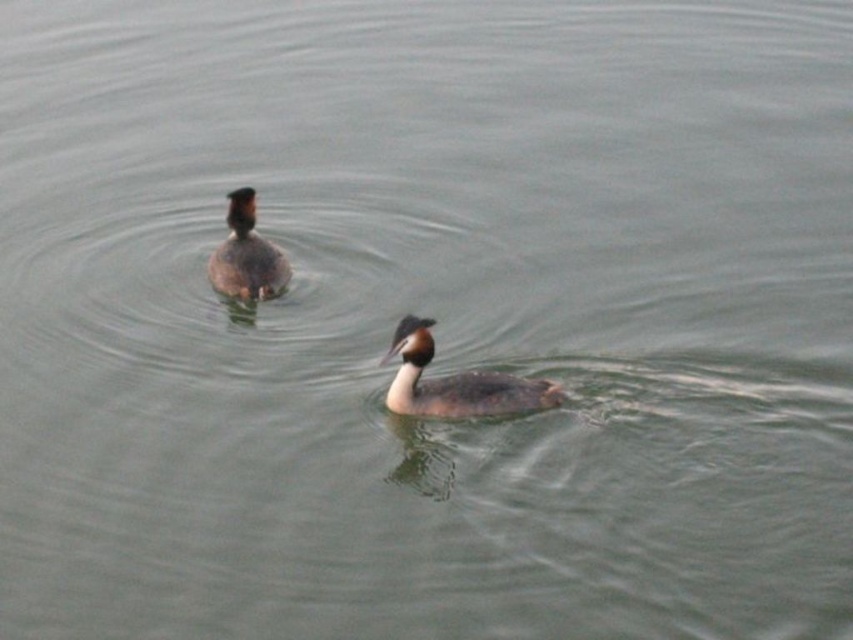
Question: Does brown matte duck at center appear on the left side of brown speckled duck at upper center?

Choices:
 (A) no
 (B) yes

Answer: (A)

Question: Does brown matte duck at center appear on the right side of brown speckled duck at upper center?

Choices:
 (A) no
 (B) yes

Answer: (B)

Question: Does brown matte duck at center have a smaller size compared to brown speckled duck at upper center?

Choices:
 (A) yes
 (B) no

Answer: (B)

Question: Among these points, which one is farthest from the camera?

Choices:
 (A) [427, 406]
 (B) [264, 252]

Answer: (B)